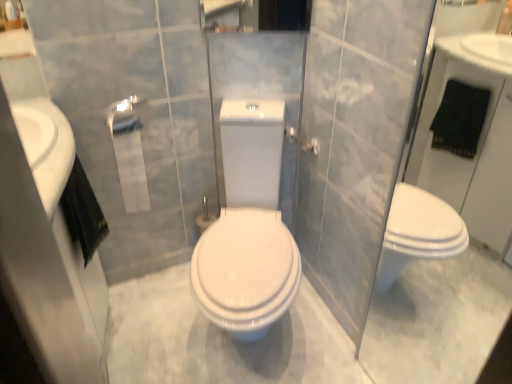
Question: Is transparent glass door at right inside white glossy sink at left?

Choices:
 (A) no
 (B) yes

Answer: (A)

Question: Is the position of white glossy sink at left less distant than that of transparent glass door at right?

Choices:
 (A) no
 (B) yes

Answer: (A)

Question: Can you confirm if white glossy sink at left is taller than transparent glass door at right?

Choices:
 (A) yes
 (B) no

Answer: (B)

Question: From a real-world perspective, is white glossy sink at left below transparent glass door at right?

Choices:
 (A) yes
 (B) no

Answer: (B)

Question: From the image's perspective, does white glossy sink at left appear lower than transparent glass door at right?

Choices:
 (A) no
 (B) yes

Answer: (A)

Question: Considering their positions, is transparent glass door at right located in front of or behind white glossy sink at left?

Choices:
 (A) front
 (B) behind

Answer: (A)

Question: Looking at their shapes, would you say transparent glass door at right is wider or thinner than white glossy sink at left?

Choices:
 (A) wide
 (B) thin

Answer: (B)

Question: Is transparent glass door at right taller or shorter than white glossy sink at left?

Choices:
 (A) tall
 (B) short

Answer: (A)

Question: Considering the positions of point (409, 145) and point (52, 193), is point (409, 145) closer or farther from the camera than point (52, 193)?

Choices:
 (A) farther
 (B) closer

Answer: (A)

Question: In the image, is silver metallic towel bar at upper center on the left side or the right side of transparent glass door at right?

Choices:
 (A) left
 (B) right

Answer: (A)

Question: Considering the positions of silver metallic towel bar at upper center and transparent glass door at right in the image, is silver metallic towel bar at upper center wider or thinner than transparent glass door at right?

Choices:
 (A) thin
 (B) wide

Answer: (B)

Question: Is silver metallic towel bar at upper center inside the boundaries of transparent glass door at right, or outside?

Choices:
 (A) inside
 (B) outside

Answer: (B)

Question: Considering the positions of silver metallic towel bar at upper center and transparent glass door at right in the image, is silver metallic towel bar at upper center bigger or smaller than transparent glass door at right?

Choices:
 (A) big
 (B) small

Answer: (B)

Question: Is white matte toilet paper at center taller or shorter than silver metallic towel bar at upper center?

Choices:
 (A) short
 (B) tall

Answer: (B)

Question: Visually, is white matte toilet paper at center positioned to the left or to the right of silver metallic towel bar at upper center?

Choices:
 (A) right
 (B) left

Answer: (B)